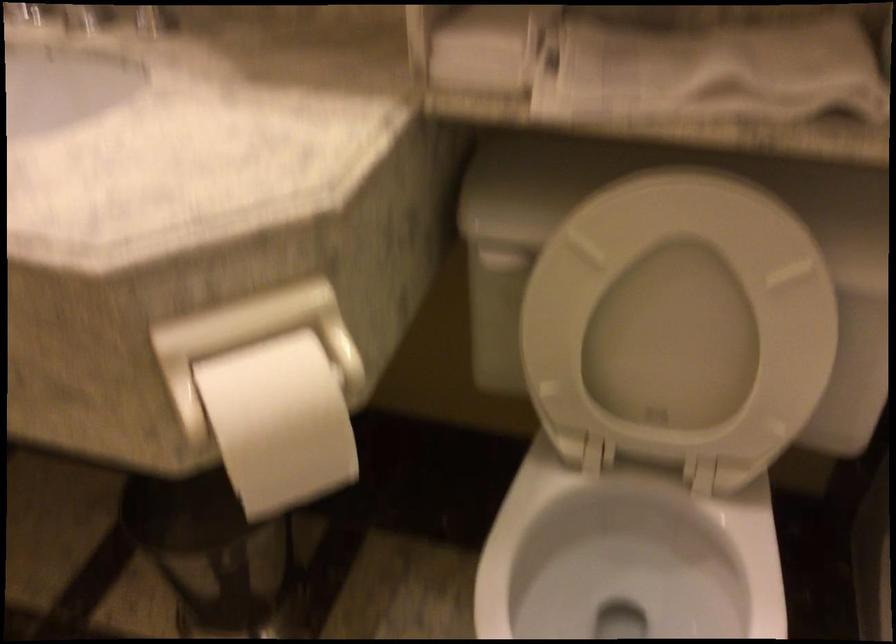
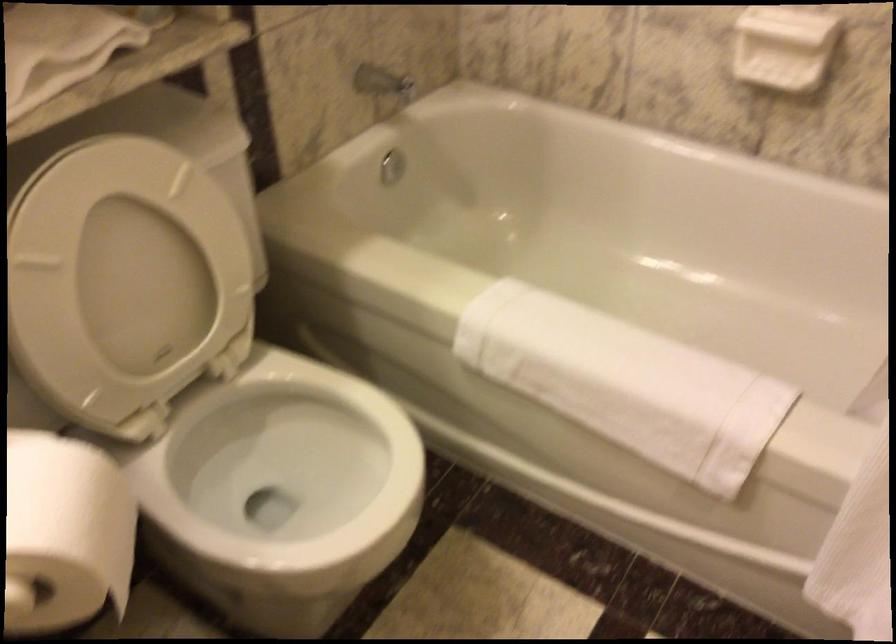
In the second image, find the point that corresponds to (684,308) in the first image.

(126, 266)